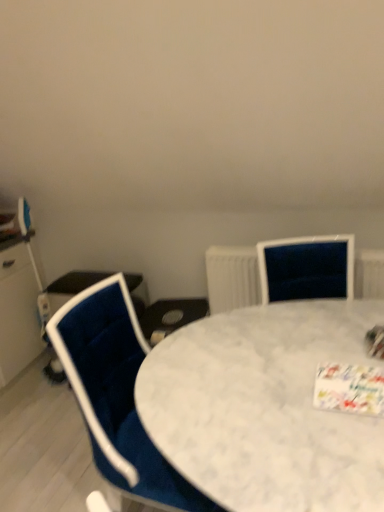
Question: Is point (380, 263) positioned closer to the camera than point (91, 297)?

Choices:
 (A) closer
 (B) farther

Answer: (B)

Question: From a real-world perspective, relative to velvet blue chair at left, is white textured radiator at upper right vertically above or below?

Choices:
 (A) above
 (B) below

Answer: (A)

Question: Considering the real-world distances, which object is farthest from the white marble table at center?

Choices:
 (A) velvet blue chair at left
 (B) white textured radiator at upper right

Answer: (B)

Question: Considering the real-world distances, which object is farthest from the white textured radiator at upper right?

Choices:
 (A) white marble table at center
 (B) velvet blue chair at left

Answer: (B)